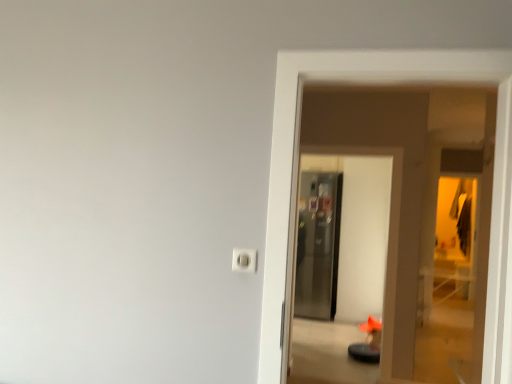
Describe the element at coordinates (318, 245) in the screenshot. I see `metallic glass screen door at center, which appears as the second screen door when viewed from the front` at that location.

Describe the element at coordinates (350, 272) in the screenshot. I see `satin metallic refrigerator at center, placed as the 1th screen door when sorted from front to back` at that location.

You are a GUI agent. You are given a task and a screenshot of the screen. Output one action in this format:
    pyautogui.click(x=<x>, y=<y>)
    Task: Click on the metallic glass screen door at center, which appears as the second screen door when viewed from the front
    The height and width of the screenshot is (384, 512).
    Given the screenshot: What is the action you would take?
    pyautogui.click(x=318, y=245)

From a real-world perspective, is white plastic outlet at center under satin metallic refrigerator at center, which is counted as the second screen door, starting from the back?

Incorrect, from a real-world perspective, white plastic outlet at center is higher than satin metallic refrigerator at center, which is counted as the second screen door, starting from the back.

How many degrees apart are the facing directions of white plastic outlet at center and satin metallic refrigerator at center, placed as the 1th screen door when sorted from front to back?

0.53 degrees separate the facing orientations of white plastic outlet at center and satin metallic refrigerator at center, placed as the 1th screen door when sorted from front to back.

Between white plastic outlet at center and satin metallic refrigerator at center, which is counted as the second screen door, starting from the back, which one has larger size?

satin metallic refrigerator at center, which is counted as the second screen door, starting from the back, is bigger.

Considering the relative sizes of white plastic outlet at center and satin metallic refrigerator at center, placed as the 1th screen door when sorted from front to back, in the image provided, is white plastic outlet at center thinner than satin metallic refrigerator at center, placed as the 1th screen door when sorted from front to back,?

Correct, the width of white plastic outlet at center is less than that of satin metallic refrigerator at center, placed as the 1th screen door when sorted from front to back.

Measure the distance from white plastic outlet at center to metallic glass screen door at center, which appears as the second screen door when viewed from the front.

12.75 feet.

Is white plastic outlet at center facing away from metallic glass screen door at center, arranged as the first screen door when viewed from the back?

Correct, white plastic outlet at center is looking away from metallic glass screen door at center, arranged as the first screen door when viewed from the back.

From a real-world perspective, relative to metallic glass screen door at center, which appears as the second screen door when viewed from the front, is white plastic outlet at center vertically above or below?

white plastic outlet at center is above metallic glass screen door at center, which appears as the second screen door when viewed from the front.

Is point (233, 248) positioned after point (325, 246)?

No, (233, 248) is closer to viewer.

Considering the relative positions of metallic glass screen door at center, arranged as the first screen door when viewed from the back, and white plastic outlet at center in the image provided, is metallic glass screen door at center, arranged as the first screen door when viewed from the back, to the left of white plastic outlet at center from the viewer's perspective?

Incorrect, metallic glass screen door at center, arranged as the first screen door when viewed from the back, is not on the left side of white plastic outlet at center.

From the image's perspective, is metallic glass screen door at center, which appears as the second screen door when viewed from the front, over white plastic outlet at center?

No, from the image's perspective, metallic glass screen door at center, which appears as the second screen door when viewed from the front, is not on top of white plastic outlet at center.

Does metallic glass screen door at center, which appears as the second screen door when viewed from the front, have a lesser height compared to white plastic outlet at center?

No.

How different are the orientations of metallic glass screen door at center, which appears as the second screen door when viewed from the front, and white plastic outlet at center in degrees?

The angle between the facing direction of metallic glass screen door at center, which appears as the second screen door when viewed from the front, and the facing direction of white plastic outlet at center is 3.9 degrees.

Does satin metallic refrigerator at center, placed as the 1th screen door when sorted from front to back, turn towards metallic glass screen door at center, arranged as the first screen door when viewed from the back?

No, satin metallic refrigerator at center, placed as the 1th screen door when sorted from front to back, is not aimed at metallic glass screen door at center, arranged as the first screen door when viewed from the back.

The height and width of the screenshot is (384, 512). In order to click on screen door to the right of satin metallic refrigerator at center, placed as the 1th screen door when sorted from front to back in this screenshot , I will do `click(318, 245)`.

Between satin metallic refrigerator at center, which is counted as the second screen door, starting from the back, and metallic glass screen door at center, which appears as the second screen door when viewed from the front, which one has larger width?

Wider between the two is metallic glass screen door at center, which appears as the second screen door when viewed from the front.

Is the surface of metallic glass screen door at center, arranged as the first screen door when viewed from the back, in direct contact with satin metallic refrigerator at center, placed as the 1th screen door when sorted from front to back?

No, metallic glass screen door at center, arranged as the first screen door when viewed from the back, is not next to satin metallic refrigerator at center, placed as the 1th screen door when sorted from front to back.

Is metallic glass screen door at center, which appears as the second screen door when viewed from the front, inside the boundaries of satin metallic refrigerator at center, which is counted as the second screen door, starting from the back, or outside?

metallic glass screen door at center, which appears as the second screen door when viewed from the front, is not enclosed by satin metallic refrigerator at center, which is counted as the second screen door, starting from the back.

Is metallic glass screen door at center, which appears as the second screen door when viewed from the front, at the left side of satin metallic refrigerator at center, which is counted as the second screen door, starting from the back?

No.

Identify the location of screen door above the metallic glass screen door at center, arranged as the first screen door when viewed from the back (from the image's perspective). [350, 272].

Is satin metallic refrigerator at center, placed as the 1th screen door when sorted from front to back, taller than white plastic outlet at center?

Indeed, satin metallic refrigerator at center, placed as the 1th screen door when sorted from front to back, has a greater height compared to white plastic outlet at center.

Is white plastic outlet at center at the back of satin metallic refrigerator at center, placed as the 1th screen door when sorted from front to back?

No, white plastic outlet at center is not at the back of satin metallic refrigerator at center, placed as the 1th screen door when sorted from front to back.

This screenshot has height=384, width=512. There is a white plastic outlet at center. In order to click on the 1st screen door below it (from the image's perspective) in this screenshot , I will do coord(350,272).

From the image's perspective, is satin metallic refrigerator at center, which is counted as the second screen door, starting from the back, located above or below white plastic outlet at center?

Based on their image positions, satin metallic refrigerator at center, which is counted as the second screen door, starting from the back, is located beneath white plastic outlet at center.

From the image's perspective, starting from the white plastic outlet at center, which screen door is the 1st one below? Please provide its 2D coordinates.

[(350, 272)]

Identify the location of the 2nd screen door counting from the right side of the white plastic outlet at center. The image size is (512, 384). (318, 245).

From the image, which object appears to be nearer to white plastic outlet at center, satin metallic refrigerator at center, which is counted as the second screen door, starting from the back, or metallic glass screen door at center, arranged as the first screen door when viewed from the back?

Based on the image, satin metallic refrigerator at center, which is counted as the second screen door, starting from the back, appears to be nearer to white plastic outlet at center.

When comparing their distances from satin metallic refrigerator at center, which is counted as the second screen door, starting from the back, does white plastic outlet at center or metallic glass screen door at center, arranged as the first screen door when viewed from the back, seem closer?

Among the two, metallic glass screen door at center, arranged as the first screen door when viewed from the back, is located nearer to satin metallic refrigerator at center, which is counted as the second screen door, starting from the back.

From the image, which object appears to be farther from metallic glass screen door at center, which appears as the second screen door when viewed from the front, white plastic outlet at center or satin metallic refrigerator at center, placed as the 1th screen door when sorted from front to back?

The object further to metallic glass screen door at center, which appears as the second screen door when viewed from the front, is white plastic outlet at center.

Looking at the image, which one is located further to satin metallic refrigerator at center, placed as the 1th screen door when sorted from front to back, metallic glass screen door at center, arranged as the first screen door when viewed from the back, or white plastic outlet at center?

white plastic outlet at center is further to satin metallic refrigerator at center, placed as the 1th screen door when sorted from front to back.

From the image, which object appears to be nearer to metallic glass screen door at center, arranged as the first screen door when viewed from the back, satin metallic refrigerator at center, which is counted as the second screen door, starting from the back, or white plastic outlet at center?

Among the two, satin metallic refrigerator at center, which is counted as the second screen door, starting from the back, is located nearer to metallic glass screen door at center, arranged as the first screen door when viewed from the back.

When comparing their distances from white plastic outlet at center, does metallic glass screen door at center, which appears as the second screen door when viewed from the front, or satin metallic refrigerator at center, which is counted as the second screen door, starting from the back, seem closer?

Based on the image, satin metallic refrigerator at center, which is counted as the second screen door, starting from the back, appears to be nearer to white plastic outlet at center.

Find the location of a particular element. This screenshot has width=512, height=384. screen door between white plastic outlet at center and metallic glass screen door at center, arranged as the first screen door when viewed from the back, in the front-back direction is located at coordinates (350, 272).